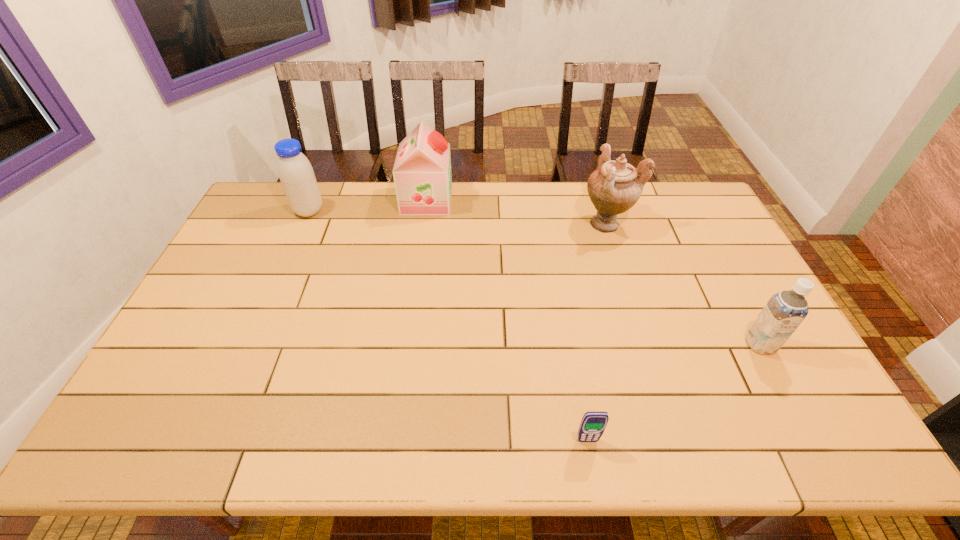
Locate an element on the screen. The width and height of the screenshot is (960, 540). vacant region at the far right corner of the desktop is located at coordinates (677, 182).

Image resolution: width=960 pixels, height=540 pixels. I want to click on vacant point located between the fourth farthest object and the fourth object from right to left, so click(x=593, y=272).

Where is `free space between the leftmost object and the cellular telephone`? The image size is (960, 540). free space between the leftmost object and the cellular telephone is located at coordinates (448, 326).

Find the location of a particular element. free spot between the second object from right to left and the rightmost object is located at coordinates (684, 284).

This screenshot has height=540, width=960. In order to click on free point between the shortest object and the leftmost soya milk in this screenshot , I will do `click(448, 326)`.

This screenshot has height=540, width=960. Identify the location of free space between the nearest soya milk and the leftmost soya milk. (535, 278).

Where is `vacant space in between the leftmost soya milk and the fourth object from right to left`? vacant space in between the leftmost soya milk and the fourth object from right to left is located at coordinates (x=368, y=205).

This screenshot has width=960, height=540. Identify the location of empty space that is in between the second object from left to right and the cellular telephone. (507, 320).

Locate an element on the screen. The width and height of the screenshot is (960, 540). free spot between the third object from left to right and the second object from left to right is located at coordinates (507, 320).

Identify the location of empty space between the leftmost soya milk and the fourth farthest object. Image resolution: width=960 pixels, height=540 pixels. (535, 278).